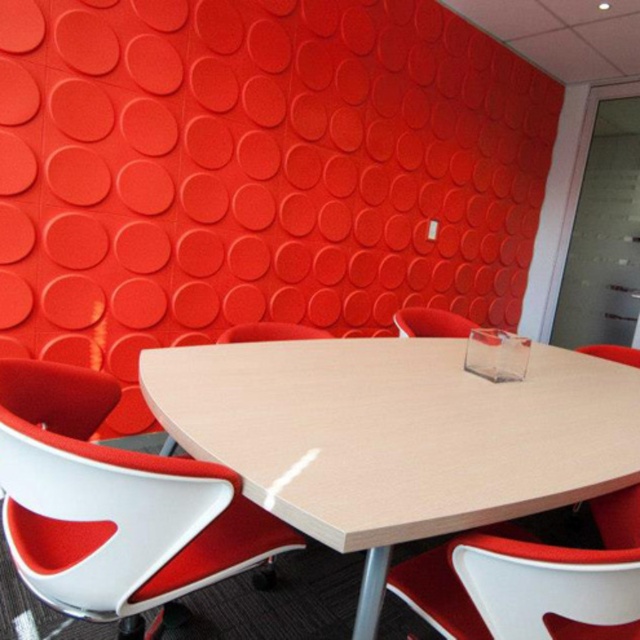
In the scene shown: Can you confirm if light wood/wooden table at center is positioned above white plastic swivel chair at lower left?

Yes, light wood/wooden table at center is above white plastic swivel chair at lower left.

Who is more forward, (387, 381) or (99, 452)?

Point (99, 452) is more forward.

The width and height of the screenshot is (640, 640). Find the location of `light wood/wooden table at center`. light wood/wooden table at center is located at coordinates coord(396,435).

Who is shorter, white plastic swivel chair at lower left or matte red chair at center?

With less height is matte red chair at center.

Is point (64, 458) positioned behind point (422, 308)?

That is False.

Is point (170, 540) more distant than point (465, 321)?

No, it is in front of (465, 321).

Where is `white plastic swivel chair at lower left`? The image size is (640, 640). white plastic swivel chair at lower left is located at coordinates (113, 506).

Which of these two, white plastic swivel chair at lower left or white matte plastic chair at lower right, stands taller?

white plastic swivel chair at lower left

Does white plastic swivel chair at lower left have a larger size compared to white matte plastic chair at lower right?

Indeed, white plastic swivel chair at lower left has a larger size compared to white matte plastic chair at lower right.

At what (x,y) coordinates should I click in order to perform the action: click on white plastic swivel chair at lower left. Please return your answer as a coordinate pair (x, y). Looking at the image, I should click on (113, 506).

Where is `white plastic swivel chair at lower left`? This screenshot has height=640, width=640. white plastic swivel chair at lower left is located at coordinates (113, 506).